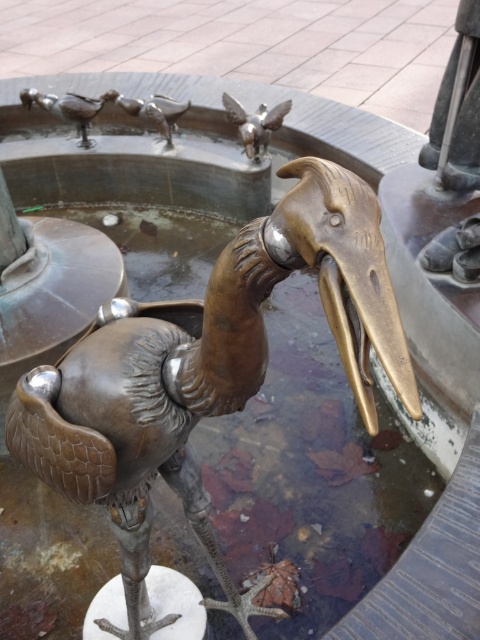
You are an art conservator assessing the fountain area. You need to determine which object is bigger between the bronze statue at center and the polished silver bird at center. Which one is larger?

The bronze statue at center is larger than the polished silver bird at center.

You are standing in a park and see the polished silver bird at center and the shiny silver birds at upper left. Which group of birds is positioned higher up in the image?

The shiny silver birds at upper left are positioned higher up in the image than the polished silver bird at center.